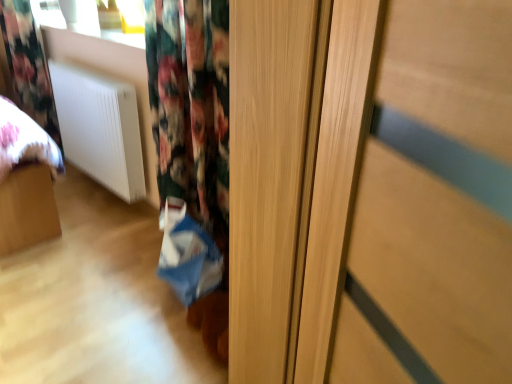
Question: In terms of size, does floral fabric curtain at upper left appear bigger or smaller than white matte radiator at lower left?

Choices:
 (A) big
 (B) small

Answer: (A)

Question: Would you say floral fabric curtain at upper left is to the left or to the right of white matte radiator at lower left in the picture?

Choices:
 (A) left
 (B) right

Answer: (A)

Question: Estimate the real-world distances between objects in this image. Which object is closer to the floral fabric curtain at upper left?

Choices:
 (A) blue fabric shopping bag at lower center
 (B) white matte radiator at lower left

Answer: (B)

Question: Considering the real-world distances, which object is closest to the floral fabric curtain at upper left?

Choices:
 (A) blue fabric shopping bag at lower center
 (B) white matte radiator at lower left

Answer: (B)